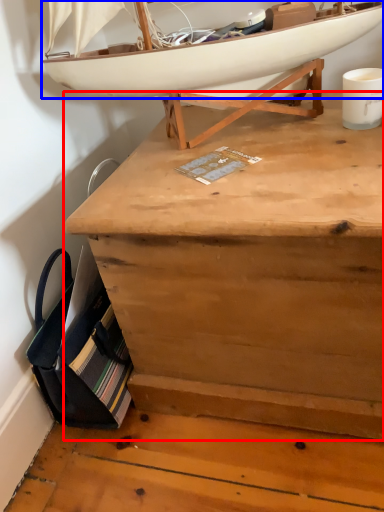
Question: Which object is closer to the camera taking this photo, desk (highlighted by a red box) or boat (highlighted by a blue box)?

Choices:
 (A) desk
 (B) boat

Answer: (A)